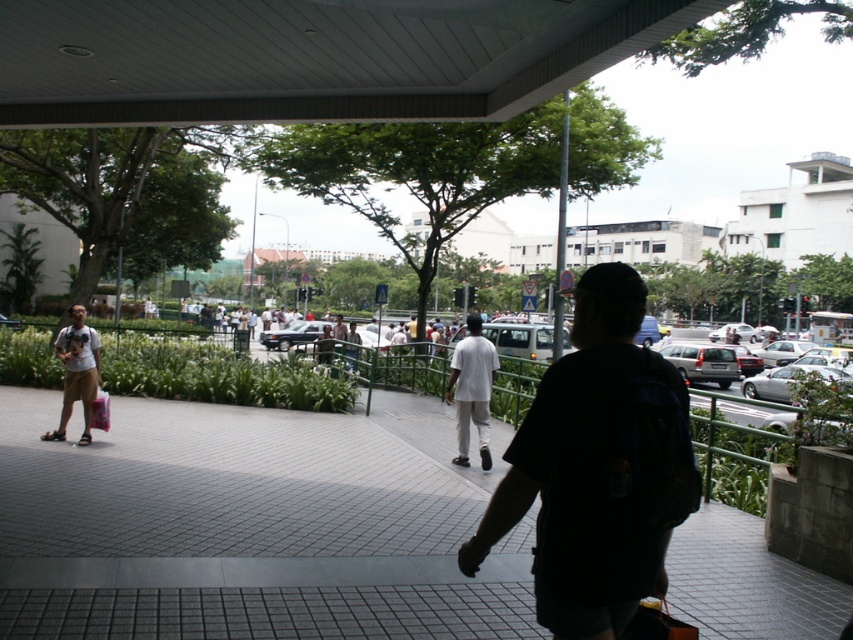
You are standing at the point closer to the camera between the two points, point 1 at coordinates (36,532) and point 2 at coordinates (592,522). If you want to walk directly towards the point further away from the camera, in which direction should you move relative to the street?

Point 1 at coordinates (36,532) is closer to the camera, so to walk towards the point further away, you should move towards the street since the further point is located in that direction.

You are a delivery person standing on the gray concrete pavement at center and need to place a package on the dark blue backpack at center. Can you reach the backpack without stepping off the pavement?

The gray concrete pavement at center is further to the viewer than dark blue backpack at center, so the backpack is closer to you. You can reach the dark blue backpack at center without stepping off the gray concrete pavement at center.

Where is the gray concrete pavement at center located in the image?

The gray concrete pavement at center is located at point (250, 524) in the image.